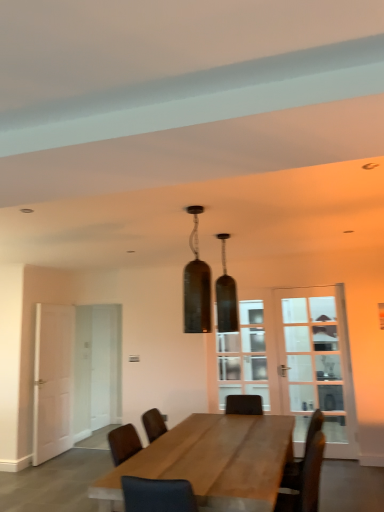
Question: From a real-world perspective, is wooden table at center on top of clear glass door at center?

Choices:
 (A) no
 (B) yes

Answer: (A)

Question: Considering the relative positions of wooden table at center and clear glass door at center in the image provided, is wooden table at center in front of clear glass door at center?

Choices:
 (A) no
 (B) yes

Answer: (B)

Question: Does wooden table at center have a greater width compared to clear glass door at center?

Choices:
 (A) yes
 (B) no

Answer: (A)

Question: Can you confirm if wooden table at center is thinner than clear glass door at center?

Choices:
 (A) no
 (B) yes

Answer: (A)

Question: Can you confirm if wooden table at center is taller than clear glass door at center?

Choices:
 (A) yes
 (B) no

Answer: (B)

Question: Is matte glass pendant light at center, the 2th lamp in the front-to-back sequence, bigger or smaller than white matte door at left?

Choices:
 (A) small
 (B) big

Answer: (A)

Question: In the image, is matte glass pendant light at center, marked as the 1th lamp in a back-to-front arrangement, positioned in front of or behind white matte door at left?

Choices:
 (A) front
 (B) behind

Answer: (A)

Question: From their relative heights in the image, would you say matte glass pendant light at center, marked as the 1th lamp in a back-to-front arrangement, is taller or shorter than white matte door at left?

Choices:
 (A) short
 (B) tall

Answer: (A)

Question: Is matte glass pendant light at center, the 2th lamp in the front-to-back sequence, wider or thinner than white matte door at left?

Choices:
 (A) wide
 (B) thin

Answer: (A)

Question: Considering their positions, is clear glass door at right, the 1th glass door positioned from the right, located in front of or behind clear glass door at center?

Choices:
 (A) behind
 (B) front

Answer: (B)

Question: From a real-world perspective, is clear glass door at right, the 2th glass door positioned from the left, positioned above or below clear glass door at center?

Choices:
 (A) above
 (B) below

Answer: (B)

Question: Is clear glass door at right, the 1th glass door positioned from the right, inside or outside of clear glass door at center?

Choices:
 (A) outside
 (B) inside

Answer: (A)

Question: From their relative heights in the image, would you say clear glass door at right, which is counted as the 1th glass door, starting from the front, is taller or shorter than clear glass door at center?

Choices:
 (A) short
 (B) tall

Answer: (B)

Question: Is point (49, 326) closer or farther from the camera than point (236, 362)?

Choices:
 (A) closer
 (B) farther

Answer: (A)

Question: In the image, is white matte door at left positioned in front of or behind clear glass door at center?

Choices:
 (A) front
 (B) behind

Answer: (A)